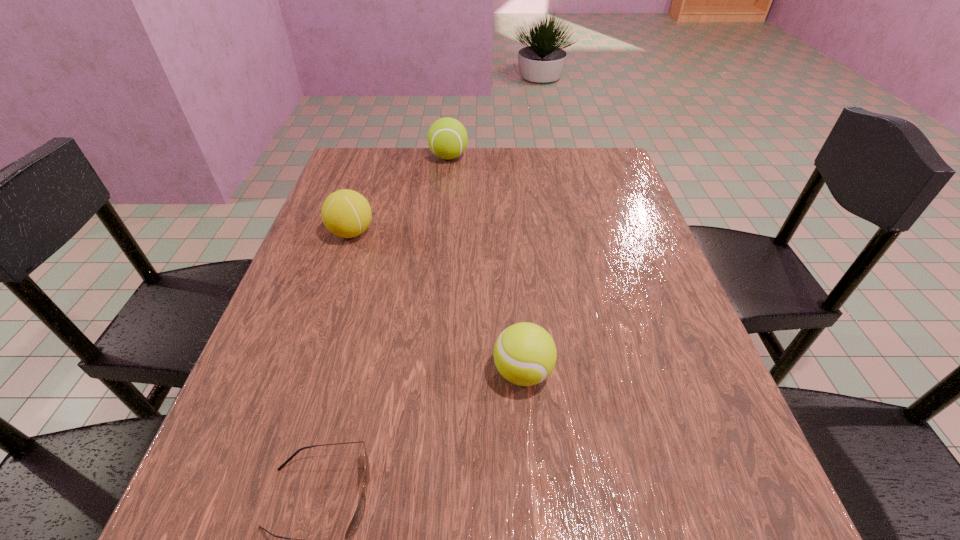
What are the coordinates of `object positioned at the left edge` in the screenshot? It's located at pyautogui.click(x=346, y=213).

Where is `free space at the far edge of the desktop`? The height and width of the screenshot is (540, 960). free space at the far edge of the desktop is located at coordinates pyautogui.click(x=400, y=184).

Find the location of a particular element. free space at the near edge of the desktop is located at coordinates [x=646, y=532].

You are a GUI agent. You are given a task and a screenshot of the screen. Output one action in this format:
    pyautogui.click(x=<x>, y=<y>)
    Task: Click on the free space at the left edge
    The height and width of the screenshot is (540, 960).
    Given the screenshot: What is the action you would take?
    pyautogui.click(x=239, y=412)

Identify the location of vacant space at the right edge of the desktop. Image resolution: width=960 pixels, height=540 pixels. (639, 347).

This screenshot has width=960, height=540. In the image, there is a desktop. In order to click on blank space at the far left corner in this screenshot , I will do `click(354, 171)`.

You are a GUI agent. You are given a task and a screenshot of the screen. Output one action in this format:
    pyautogui.click(x=<x>, y=<y>)
    Task: Click on the vacant space at the far right corner of the desktop
    
    Given the screenshot: What is the action you would take?
    pyautogui.click(x=588, y=147)

Image resolution: width=960 pixels, height=540 pixels. Find the location of `vacant area that lies between the second object from right to left and the second farthest tennis ball`. vacant area that lies between the second object from right to left and the second farthest tennis ball is located at coordinates (400, 195).

Locate an element on the screen. This screenshot has width=960, height=540. vacant area that lies between the rightmost tennis ball and the second object from right to left is located at coordinates (486, 265).

This screenshot has height=540, width=960. Find the location of `empty space that is in between the leftmost tennis ball and the farthest tennis ball`. empty space that is in between the leftmost tennis ball and the farthest tennis ball is located at coordinates (400, 195).